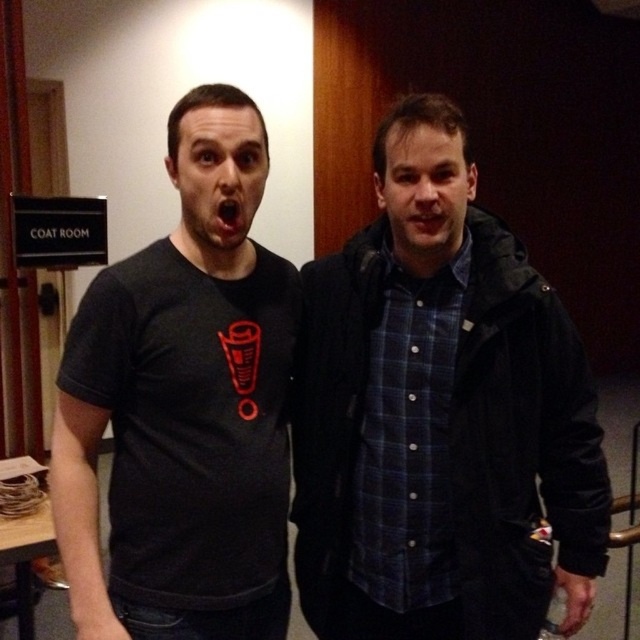
You are standing at the COAT ROOM sign and want to move towards the exit located at point (212, 499). There is an obstacle at point (436, 300). Which point should you avoid to reach the exit safely?

You should avoid point (436, 300) because it is behind point (212, 499), meaning it is further away from the exit and blocking your path.